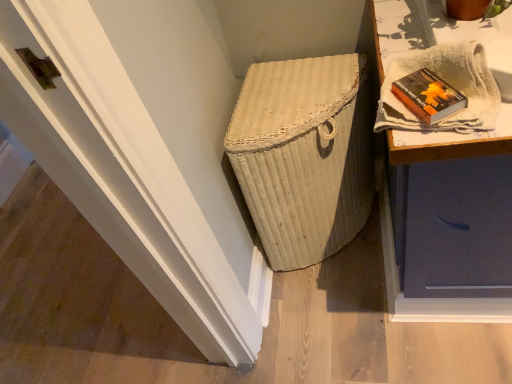
I want to click on hardcover book at upper right, so click(x=428, y=96).

Considering the relative positions of hardcover book at upper right and white wicker basket at center in the image provided, is hardcover book at upper right to the right of white wicker basket at center from the viewer's perspective?

Yes, hardcover book at upper right is to the right of white wicker basket at center.

Is hardcover book at upper right turned away from white wicker basket at center?

No, hardcover book at upper right's orientation is not away from white wicker basket at center.

Does hardcover book at upper right touch white wicker basket at center?

hardcover book at upper right and white wicker basket at center are not in contact.

How many degrees apart are the facing directions of hardcover book at upper right and white wicker basket at center?

hardcover book at upper right and white wicker basket at center are facing 29.4 degrees away from each other.

Does point (304, 84) come farther from viewer compared to point (405, 77)?

Yes, point (304, 84) is farther from viewer.

Based on the photo, from their relative heights in the image, would you say white wicker basket at center is taller or shorter than hardcover book at upper right?

white wicker basket at center is taller than hardcover book at upper right.

Does white wicker basket at center contain hardcover book at upper right?

No, hardcover book at upper right is located outside of white wicker basket at center.

Is white wicker basket at center next to hardcover book at upper right and touching it?

white wicker basket at center is not next to hardcover book at upper right, and they're not touching.

Is hardcover book at upper right surrounding white textured cloth at upper right?

Definitely not — white textured cloth at upper right is not inside hardcover book at upper right.

From a real-world perspective, who is located lower, hardcover book at upper right or white textured cloth at upper right?

hardcover book at upper right, from a real-world perspective.

Is hardcover book at upper right oriented away from white textured cloth at upper right?

That's right, hardcover book at upper right is facing away from white textured cloth at upper right.

Which of these two, hardcover book at upper right or white textured cloth at upper right, stands shorter?

hardcover book at upper right is shorter.

Locate an element on the screen. basket container on the left of the white textured cloth at upper right is located at coordinates click(x=304, y=155).

Which of these two, white textured cloth at upper right or white wicker basket at center, stands taller?

white wicker basket at center is taller.

Does white textured cloth at upper right touch white wicker basket at center?

No, white textured cloth at upper right is not touching white wicker basket at center.

Is white textured cloth at upper right in front of or behind hardcover book at upper right in the image?

white textured cloth at upper right is positioned closer to the viewer than hardcover book at upper right.

Is point (409, 117) positioned in front of point (426, 118)?

No, (409, 117) is behind (426, 118).

From a real-world perspective, is white textured cloth at upper right positioned above or below hardcover book at upper right?

Clearly, from a real-world perspective, white textured cloth at upper right is above hardcover book at upper right.

In the image, is white textured cloth at upper right on the left side or the right side of hardcover book at upper right?

white textured cloth at upper right is to the right of hardcover book at upper right.

I want to click on cloth that is above the white wicker basket at center (from a real-world perspective), so click(448, 83).

From the image's perspective, which is below, white wicker basket at center or white textured cloth at upper right?

white wicker basket at center is shown below in the image.

Does point (253, 184) appear closer or farther from the camera than point (476, 125)?

Point (253, 184) is farther from the camera than point (476, 125).

Is white wicker basket at center outside of white textured cloth at upper right?

Yes, white wicker basket at center is not within white textured cloth at upper right.

You are a GUI agent. You are given a task and a screenshot of the screen. Output one action in this format:
    pyautogui.click(x=<x>, y=<y>)
    Task: Click on the book in front of the white wicker basket at center
    
    Given the screenshot: What is the action you would take?
    pyautogui.click(x=428, y=96)

Locate an element on the screen. basket container that is behind the hardcover book at upper right is located at coordinates (304, 155).

Based on the photo, estimate the real-world distances between objects in this image. Which object is closer to white wicker basket at center, hardcover book at upper right or white textured cloth at upper right?

The object closer to white wicker basket at center is white textured cloth at upper right.

Based on their spatial positions, is white textured cloth at upper right or white wicker basket at center further from hardcover book at upper right?

white wicker basket at center is further to hardcover book at upper right.

Estimate the real-world distances between objects in this image. Which object is further from white wicker basket at center, white textured cloth at upper right or hardcover book at upper right?

The object further to white wicker basket at center is hardcover book at upper right.

Which object lies nearer to the anchor point white textured cloth at upper right, hardcover book at upper right or white wicker basket at center?

Based on the image, hardcover book at upper right appears to be nearer to white textured cloth at upper right.

Which object lies nearer to the anchor point hardcover book at upper right, white wicker basket at center or white textured cloth at upper right?

white textured cloth at upper right is closer to hardcover book at upper right.

Looking at the image, which one is located closer to white textured cloth at upper right, white wicker basket at center or hardcover book at upper right?

The object closer to white textured cloth at upper right is hardcover book at upper right.

You are a GUI agent. You are given a task and a screenshot of the screen. Output one action in this format:
    pyautogui.click(x=<x>, y=<y>)
    Task: Click on the book between white textured cloth at upper right and white wicker basket at center in the front-back direction
    The image size is (512, 384).
    Given the screenshot: What is the action you would take?
    (x=428, y=96)